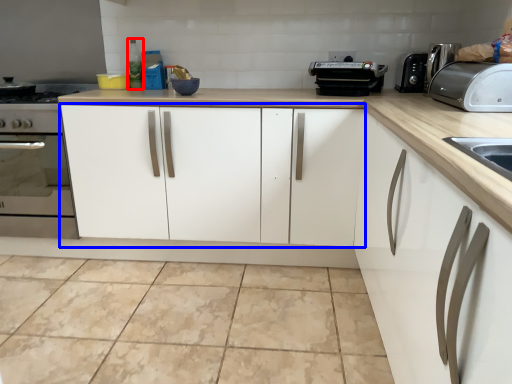
Question: Which point is further to the camera, bottle (highlighted by a red box) or cabinetry (highlighted by a blue box)?

Choices:
 (A) bottle
 (B) cabinetry

Answer: (A)